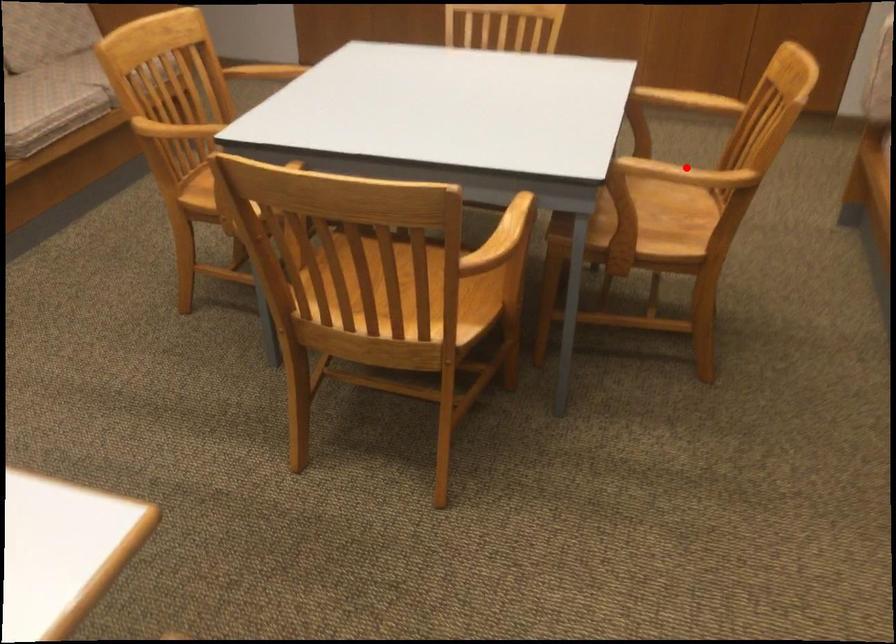
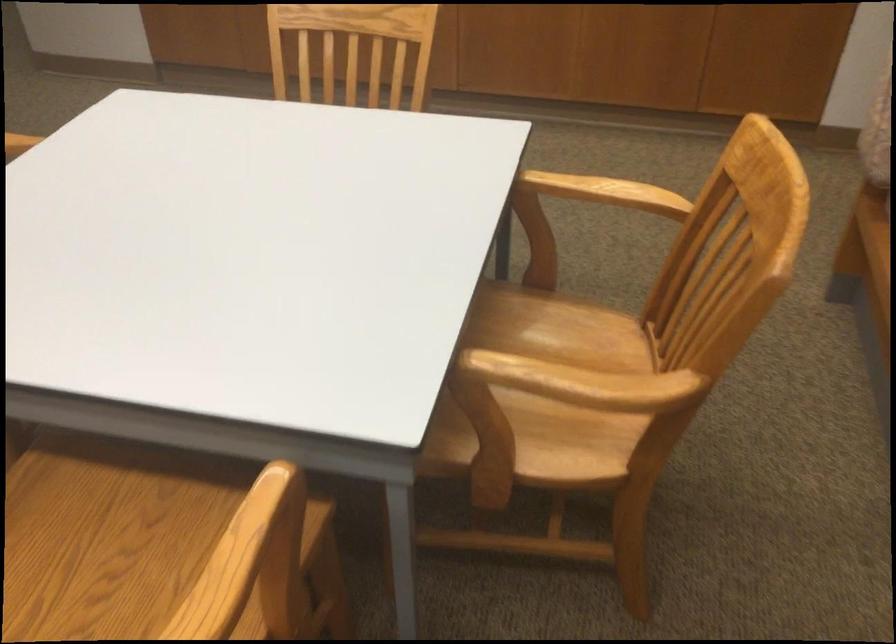
Question: A red point is marked in image1. In image2, is the corresponding 3D point closer to the camera or farther? Reply with the corresponding letter.

Choices:
 (A) The corresponding 3D point is closer.
 (B) The corresponding 3D point is farther.

Answer: (A)